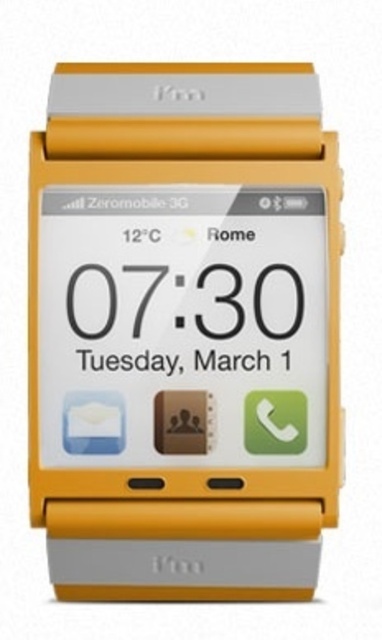
Question: Can you confirm if yellow matte smartwatch at center is smaller than black glossy clock face at center?

Choices:
 (A) yes
 (B) no

Answer: (B)

Question: Which point is closer to the camera taking this photo?

Choices:
 (A) (205, 273)
 (B) (210, 109)

Answer: (B)

Question: Which of the following is the closest to the observer?

Choices:
 (A) black glossy clock face at center
 (B) yellow matte smartwatch at center

Answer: (B)

Question: Which object appears farthest from the camera in this image?

Choices:
 (A) yellow matte smartwatch at center
 (B) black glossy clock face at center

Answer: (B)

Question: Does yellow matte smartwatch at center appear on the left side of black glossy clock face at center?

Choices:
 (A) no
 (B) yes

Answer: (A)

Question: Does yellow matte smartwatch at center appear over black glossy clock face at center?

Choices:
 (A) no
 (B) yes

Answer: (A)